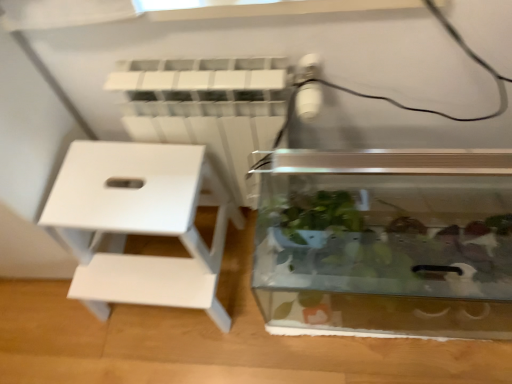
Locate an element on the screen. The image size is (512, 384). free point in front of white plastic radiator at upper center is located at coordinates (248, 328).